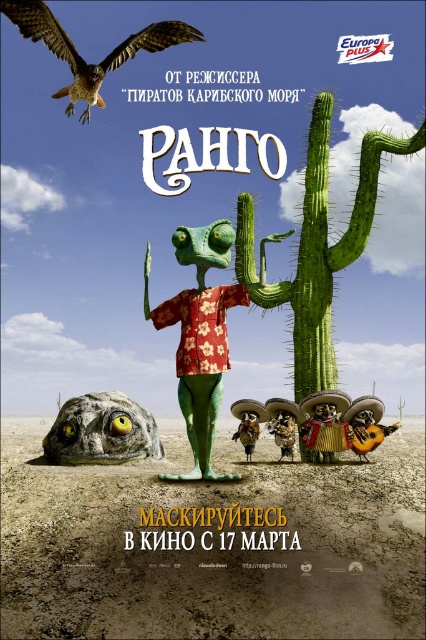
Question: Which object is positioned closest to the green matte lizard at center?

Choices:
 (A) green spiny cactus at center
 (B) brown feathered falcon at upper left

Answer: (A)

Question: Which of the following is the closest to the observer?

Choices:
 (A) 284,301
 (B) 204,451
 (C) 34,26

Answer: (B)

Question: Which point is closer to the camera?

Choices:
 (A) (322, 368)
 (B) (187, 428)
 (C) (121, 48)

Answer: (B)

Question: Is green spiny cactus at center wider than green matte lizard at center?

Choices:
 (A) no
 (B) yes

Answer: (B)

Question: Does green matte lizard at center appear over brown feathered falcon at upper left?

Choices:
 (A) no
 (B) yes

Answer: (A)

Question: Can you confirm if green spiny cactus at center is positioned to the right of brown feathered falcon at upper left?

Choices:
 (A) yes
 (B) no

Answer: (A)